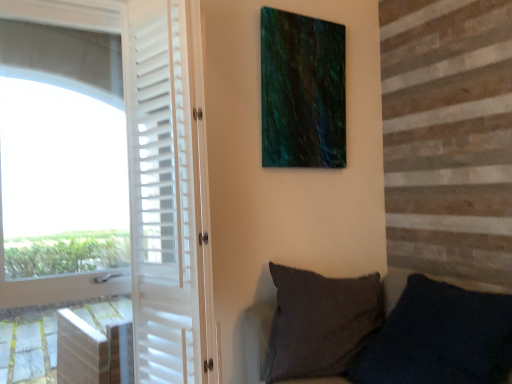
Question: Is white matte door at left wider or thinner than dark gray fabric pillow at lower right?

Choices:
 (A) wide
 (B) thin

Answer: (B)

Question: Considering the positions of white matte door at left and dark gray fabric pillow at lower right in the image, is white matte door at left taller or shorter than dark gray fabric pillow at lower right?

Choices:
 (A) short
 (B) tall

Answer: (B)

Question: Estimate the real-world distances between objects in this image. Which object is closer to the white matte door at left?

Choices:
 (A) dark gray fabric pillow at lower right
 (B) white matte screen door at left
 (C) green textured canvas at upper center

Answer: (B)

Question: Which object is positioned closest to the white matte screen door at left?

Choices:
 (A) dark gray fabric pillow at lower right
 (B) white matte door at left
 (C) green textured canvas at upper center

Answer: (B)